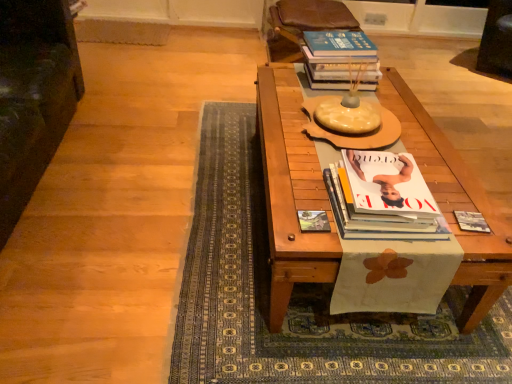
In order to click on vacant space behind dark green fabric armchair at left, marked as the second armchair in a back-to-front arrangement in this screenshot , I will do `click(142, 99)`.